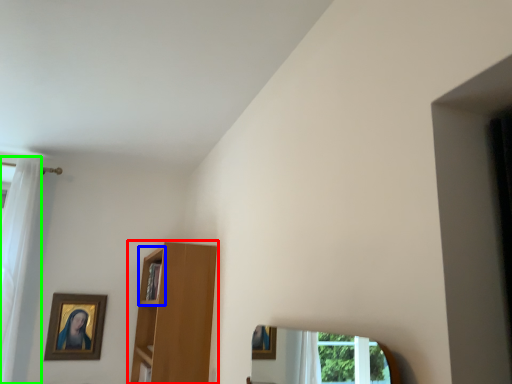
Question: Which object is positioned farthest from shelf (highlighted by a red box)? Select from cabinet (highlighted by a blue box) and curtain (highlighted by a green box).

Choices:
 (A) cabinet
 (B) curtain

Answer: (B)